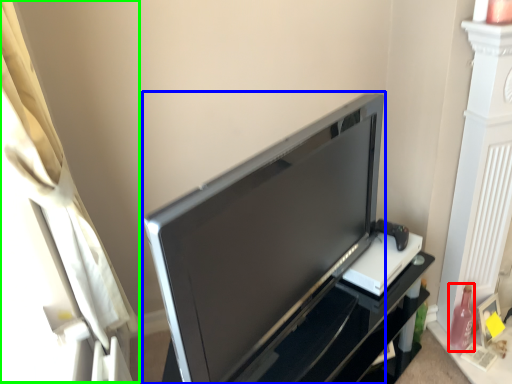
Question: Considering the real-world distances, which object is closest to bottle (highlighted by a red box)? television (highlighted by a blue box) or curtain (highlighted by a green box).

Choices:
 (A) television
 (B) curtain

Answer: (A)